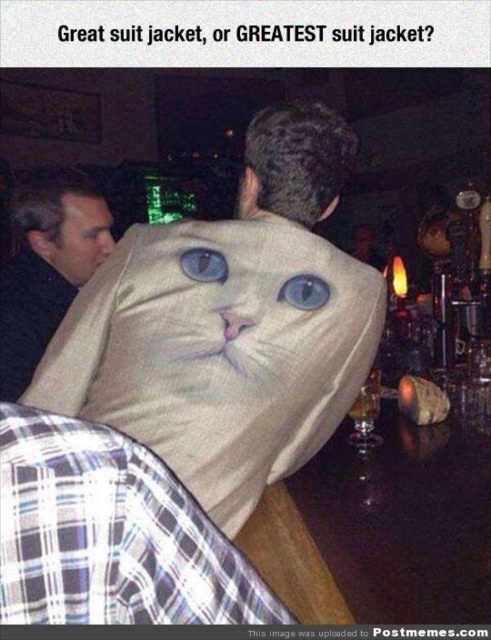
You are a photographer standing at the camera position in the scene. You need to place a sticker exactly at point (x=211, y=273). The sticker is 12 inches in diameter. Will the sticker cover the man in the suit with the cat face on the back?

The distance between the camera and point (x=211, y=273) is 36.91 inches. The sticker is 12 inches in diameter. Since the sticker is placed at that point, its size would be relative to the distance, but the question is about coverage. However, without knowing the man s size or the sticker s perspective scaling, we can t accurately determine coverage. The answer might require more information, but based on given data, the sticker s diameter is smaller than the distance, so it might not cover the man fully.

You are a fashion designer observing a man wearing a beige fabric cat at center and a matte black jacket at upper left. Which item of clothing is shorter in height?

The beige fabric cat at center is not as tall as the matte black jacket at upper left, so the beige fabric cat at center is shorter in height.

You are a photographer trying to capture the man in the suit jacket with the cat face. You need to position your camera so that the matte black jacket at upper left is visible in the frame. Where should you place your camera relative to the man?

The matte black jacket at upper left is located at point (47, 266), so you should position your camera to the upper left side of the man to ensure the matte black jacket at upper left is visible in the frame.